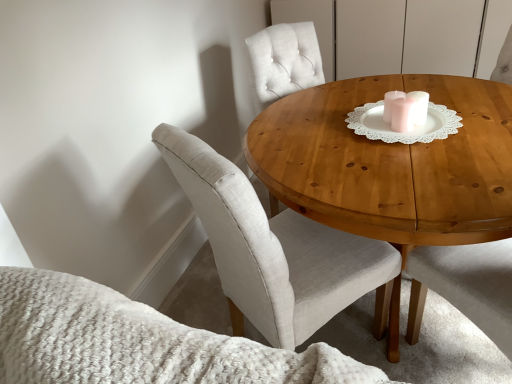
Where is `vacant space in front of white lace doily at center`? This screenshot has width=512, height=384. vacant space in front of white lace doily at center is located at coordinates (408, 145).